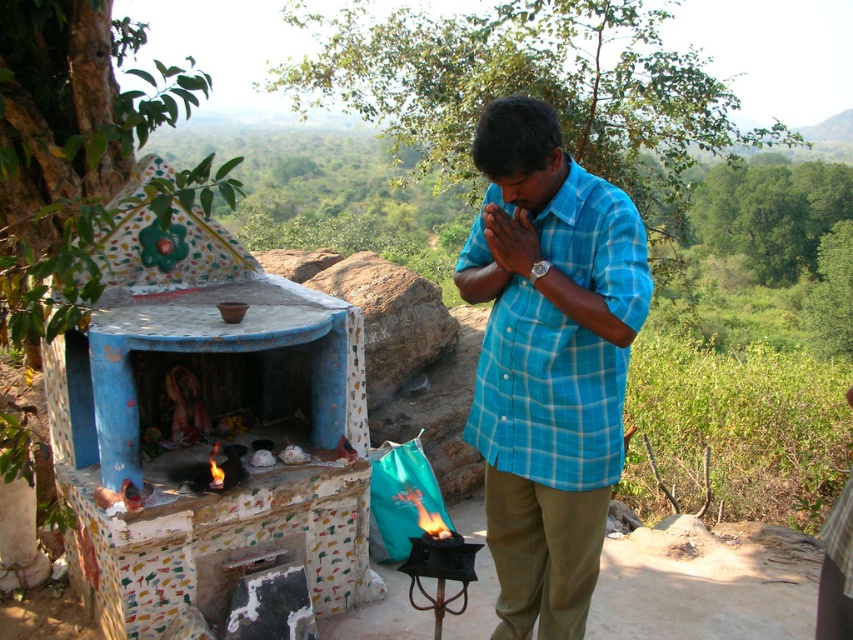
Does blue plaid shirt at center have a lesser height compared to matte blue shirt at center?

No, blue plaid shirt at center is not shorter than matte blue shirt at center.

In the scene shown: Between blue plaid shirt at center and matte blue shirt at center, which one has more height?

blue plaid shirt at center

Looking at this image, who is more forward, (582, 547) or (534, 256)?

Point (534, 256) is more forward.

This screenshot has height=640, width=853. I want to click on blue plaid shirt at center, so click(550, 365).